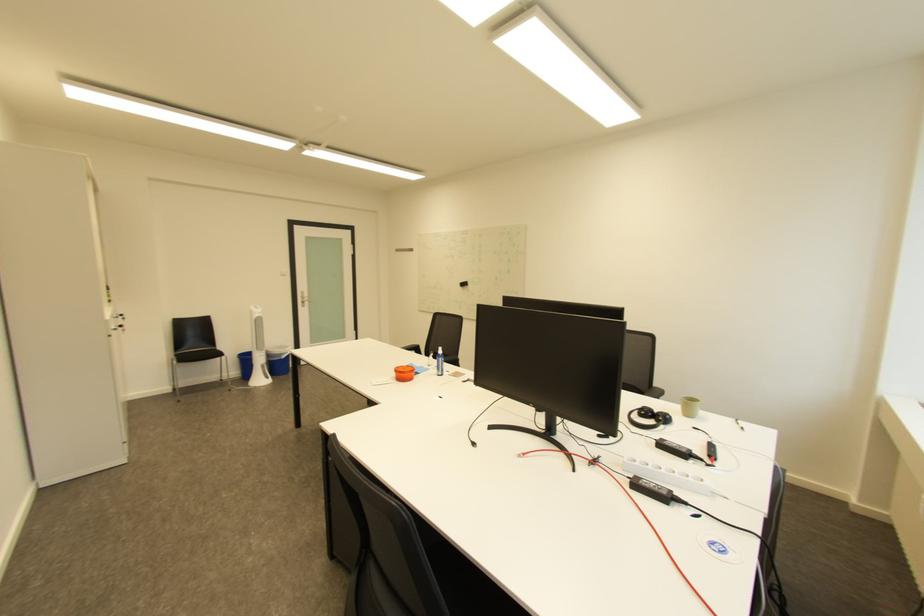
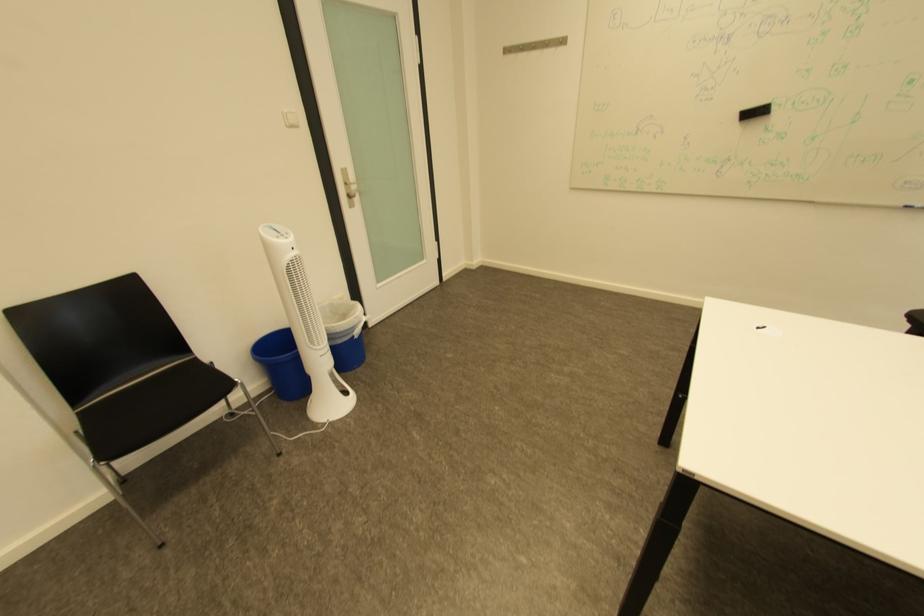
What movement of the cameraman would produce the second image?

The cameraman walked toward left, forward.